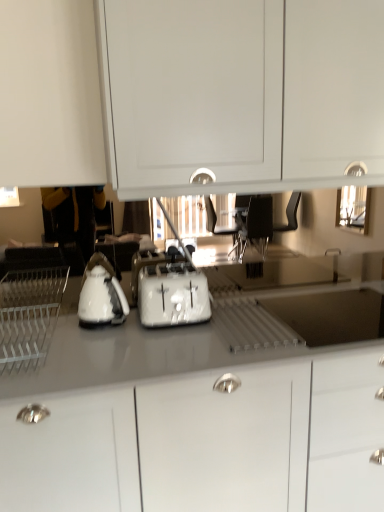
Question: Could white plastic dish rack at left be considered to be inside white plastic toaster at center?

Choices:
 (A) yes
 (B) no

Answer: (B)

Question: Is white plastic toaster at center aimed at white plastic dish rack at left?

Choices:
 (A) no
 (B) yes

Answer: (A)

Question: Does white plastic toaster at center lie behind white plastic dish rack at left?

Choices:
 (A) yes
 (B) no

Answer: (A)

Question: Does white plastic toaster at center appear on the left side of white plastic dish rack at left?

Choices:
 (A) yes
 (B) no

Answer: (B)

Question: Considering the relative sizes of white plastic toaster at center and white plastic dish rack at left in the image provided, is white plastic toaster at center taller than white plastic dish rack at left?

Choices:
 (A) yes
 (B) no

Answer: (A)

Question: Is the position of white plastic toaster at center less distant than that of white plastic dish rack at left?

Choices:
 (A) yes
 (B) no

Answer: (B)

Question: Considering the relative sizes of white matte cabinet at upper center, which is the first cabinetry from top to bottom, and white glossy cabinet at center, acting as the 2th cabinetry starting from the top, in the image provided, is white matte cabinet at upper center, which is the first cabinetry from top to bottom, bigger than white glossy cabinet at center, acting as the 2th cabinetry starting from the top,?

Choices:
 (A) yes
 (B) no

Answer: (B)

Question: From the image's perspective, is white matte cabinet at upper center, which appears as the 2th cabinetry when ordered from the bottom, over white glossy cabinet at center, which ranks as the first cabinetry in bottom-to-top order?

Choices:
 (A) no
 (B) yes

Answer: (B)

Question: Does white matte cabinet at upper center, which is the first cabinetry from top to bottom, appear on the right side of white glossy cabinet at center, which ranks as the first cabinetry in bottom-to-top order?

Choices:
 (A) no
 (B) yes

Answer: (B)

Question: From the image's perspective, does white matte cabinet at upper center, which is the first cabinetry from top to bottom, appear lower than white glossy cabinet at center, which ranks as the first cabinetry in bottom-to-top order?

Choices:
 (A) yes
 (B) no

Answer: (B)

Question: Is white matte cabinet at upper center, which appears as the 2th cabinetry when ordered from the bottom, positioned with its back to white glossy cabinet at center, which ranks as the first cabinetry in bottom-to-top order?

Choices:
 (A) yes
 (B) no

Answer: (B)

Question: Does white matte cabinet at upper center, which is the first cabinetry from top to bottom, contain white glossy cabinet at center, which ranks as the first cabinetry in bottom-to-top order?

Choices:
 (A) no
 (B) yes

Answer: (A)

Question: Is white glossy cabinet at center, which ranks as the first cabinetry in bottom-to-top order, facing towards white glossy electric kettle at center?

Choices:
 (A) no
 (B) yes

Answer: (A)